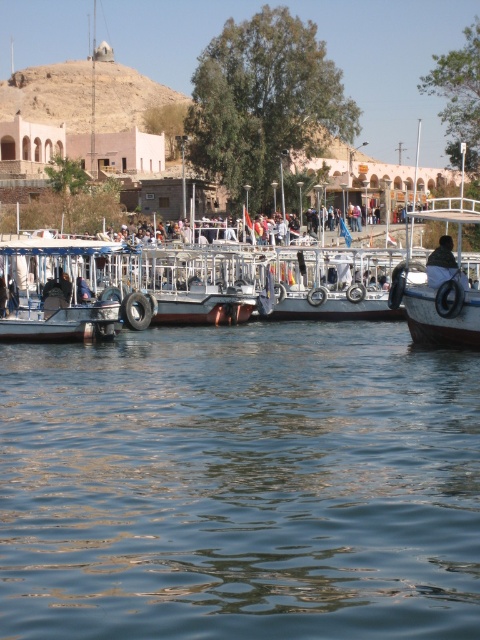
Image resolution: width=480 pixels, height=640 pixels. Identify the location of white wooden boat at left. (60, 289).

Does point (46, 316) come in front of point (451, 324)?

No, it is behind (451, 324).

Where is `white wooden boat at left`? This screenshot has height=640, width=480. white wooden boat at left is located at coordinates pyautogui.click(x=60, y=289).

Is white wooden boat at left below dark brown leather jacket at center?

Actually, white wooden boat at left is above dark brown leather jacket at center.

Is white wooden boat at left to the right of dark brown leather jacket at center from the viewer's perspective?

In fact, white wooden boat at left is to the left of dark brown leather jacket at center.

At what (x,y) coordinates should I click in order to perform the action: click on white wooden boat at left. Please return your answer as a coordinate pair (x, y). Looking at the image, I should click on (60, 289).

The width and height of the screenshot is (480, 640). Identify the location of white wooden boat at left. (60, 289).

What do you see at coordinates (441, 282) in the screenshot?
I see `white matte boat at right` at bounding box center [441, 282].

Between point (444, 218) and point (462, 275), which one is positioned behind?

The point (444, 218) is more distant.

Who is more distant from viewer, (462, 260) or (456, 262)?

Positioned behind is point (462, 260).

Locate an element on the screen. This screenshot has width=480, height=640. white matte boat at right is located at coordinates (441, 282).